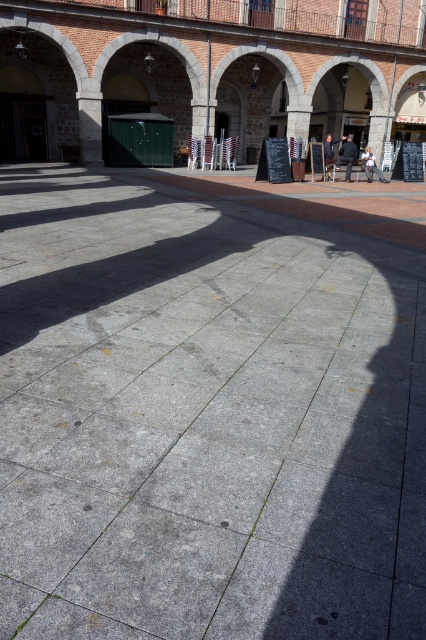
Is point (351, 157) less distant than point (368, 166)?

Yes, it is in front of point (368, 166).

Is point (337, 161) less distant than point (376, 170)?

No, (337, 161) is behind (376, 170).

This screenshot has width=426, height=640. In order to click on dark blue jacket at center in this screenshot , I will do `click(347, 156)`.

Which is above, gray concrete pavement at center or dark blue jacket at center?

Positioned higher is dark blue jacket at center.

Is point (293, 612) closer to viewer compared to point (351, 154)?

Yes, point (293, 612) is in front of point (351, 154).

Find the location of a particular element. This screenshot has height=640, width=426. gray concrete pavement at center is located at coordinates (210, 406).

Where is `gray concrete pavement at center`? This screenshot has height=640, width=426. gray concrete pavement at center is located at coordinates (210, 406).

Who is taller, light blue denim jeans at center or dark blue suit at center?

dark blue suit at center

Image resolution: width=426 pixels, height=640 pixels. I want to click on light blue denim jeans at center, so click(x=371, y=164).